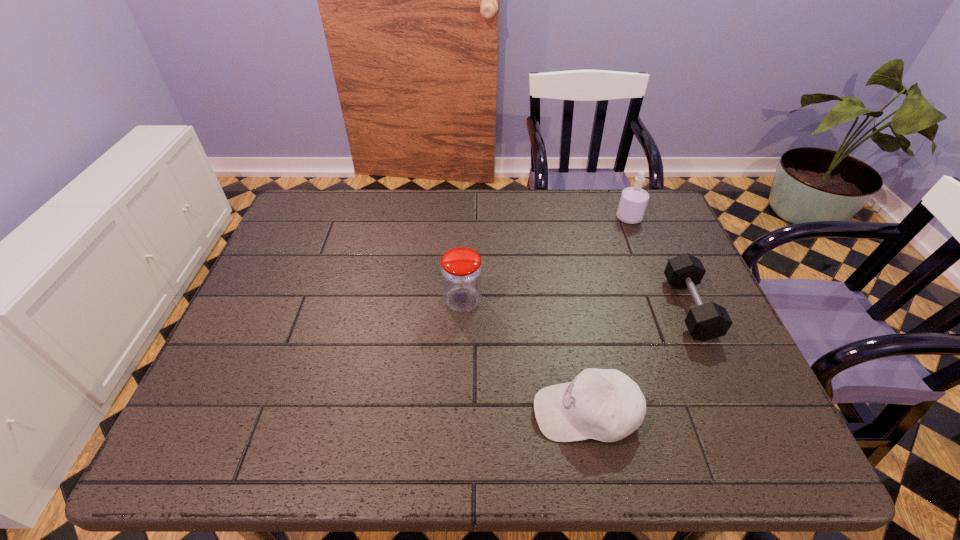
Image resolution: width=960 pixels, height=540 pixels. Find the location of `blank area at the far left corner`. blank area at the far left corner is located at coordinates (325, 190).

Identify the location of free space between the leftmost object and the nearest object. (524, 357).

You are a GUI agent. You are given a task and a screenshot of the screen. Output one action in this format:
    pyautogui.click(x=<x>, y=<y>)
    Task: Click on the blank region between the dumbbell and the leftmost object
    This screenshot has height=540, width=960.
    Given the screenshot: What is the action you would take?
    pyautogui.click(x=576, y=305)

Identify the location of vacant space that's between the perfume and the nearest object. The height and width of the screenshot is (540, 960). (607, 315).

Identify the location of free space between the jar and the dumbbell. (576, 305).

Locate an element on the screen. Image resolution: width=960 pixels, height=540 pixels. vacant point located between the nearest object and the farthest object is located at coordinates (607, 315).

Locate an element on the screen. free space between the perfume and the dumbbell is located at coordinates (660, 263).

Find the location of a particular element. unoccupied area between the nearest object and the leftmost object is located at coordinates pyautogui.click(x=524, y=357).

This screenshot has width=960, height=540. Find the location of `unoccupied position between the shortest object and the nearest object`. unoccupied position between the shortest object and the nearest object is located at coordinates (637, 360).

At what (x,y) coordinates should I click in order to perform the action: click on unoccupied position between the farthest object and the jar. Please return your answer as a coordinate pair (x, y). Looking at the image, I should click on (546, 259).